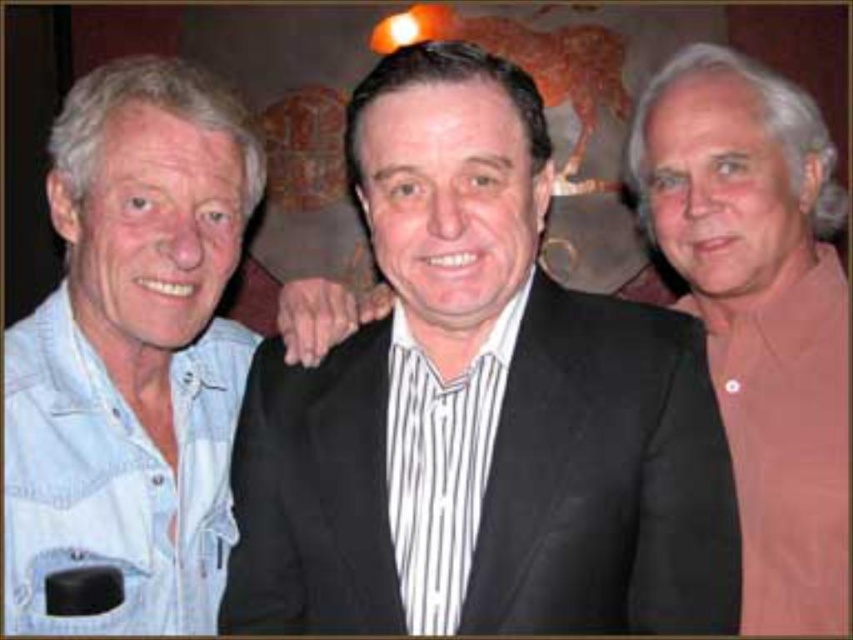
Is black striped shirt at center below pink matte shirt at right?

Yes, black striped shirt at center is below pink matte shirt at right.

Which is below, black striped shirt at center or pink matte shirt at right?

black striped shirt at center

Which is in front, point (584, 372) or point (683, 196)?

Point (584, 372)

This screenshot has width=853, height=640. I want to click on black striped shirt at center, so click(x=479, y=408).